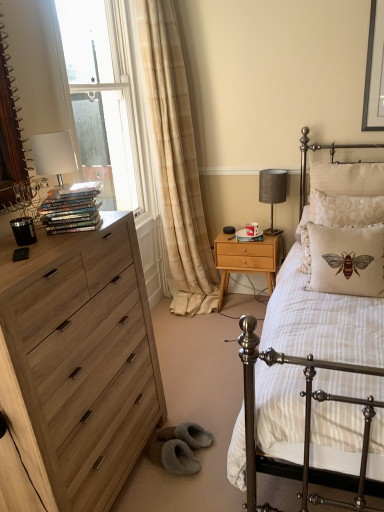
Find the location of a particular element. This screenshot has height=512, width=384. free location above light wood/texture nightstand at center (from a real-world perspective) is located at coordinates (244, 236).